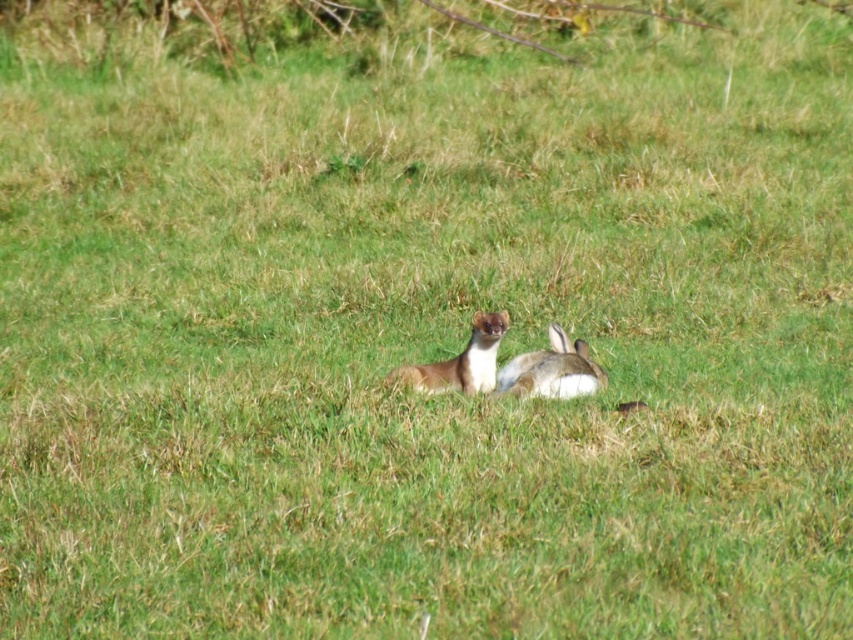
Can you confirm if furry white rabbit at center is wider than furry brown animal at center?

Incorrect, furry white rabbit at center's width does not surpass furry brown animal at center's.

Can you confirm if furry white rabbit at center is thinner than furry brown animal at center?

Indeed, furry white rabbit at center has a lesser width compared to furry brown animal at center.

Where is `furry white rabbit at center`? furry white rabbit at center is located at coordinates (552, 371).

You are a GUI agent. You are given a task and a screenshot of the screen. Output one action in this format:
    pyautogui.click(x=<x>, y=<y>)
    Task: Click on the furry white rabbit at center
    
    Given the screenshot: What is the action you would take?
    click(x=552, y=371)